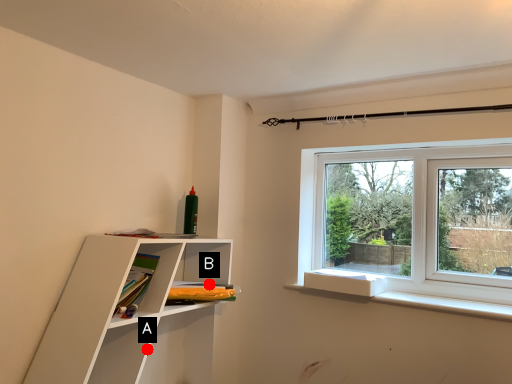
Question: Two points are circled on the image, labeled by A and B beside each circle. Which point is farther to the camera?

Choices:
 (A) A is further
 (B) B is further

Answer: (B)